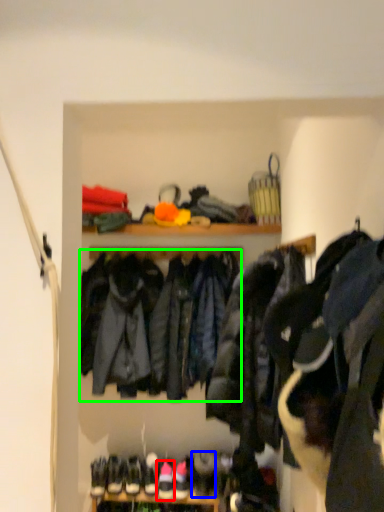
Question: Based on their relative distances, which object is farther from footwear (highlighted by a red box)? Choose from shoe (highlighted by a blue box) and jacket (highlighted by a green box).

Choices:
 (A) shoe
 (B) jacket

Answer: (B)